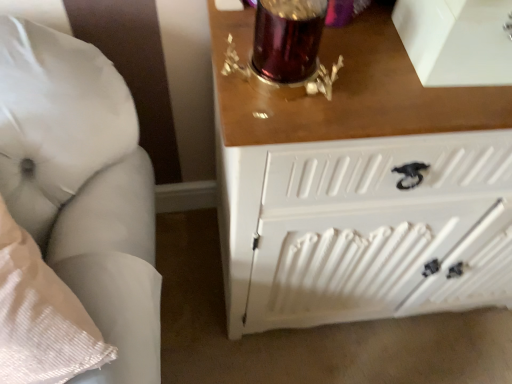
Question: Is white painted wood radiator at lower right taller or shorter than white fabric pillow at left?

Choices:
 (A) short
 (B) tall

Answer: (A)

Question: Does point (492, 216) appear closer or farther from the camera than point (153, 364)?

Choices:
 (A) farther
 (B) closer

Answer: (A)

Question: Is white painted wood radiator at lower right situated inside white fabric pillow at left or outside?

Choices:
 (A) inside
 (B) outside

Answer: (B)

Question: From a real-world perspective, relative to white painted wood radiator at lower right, is white fabric pillow at left vertically above or below?

Choices:
 (A) above
 (B) below

Answer: (A)

Question: Is point (46, 208) closer or farther from the camera than point (373, 279)?

Choices:
 (A) farther
 (B) closer

Answer: (B)

Question: From the image's perspective, is white fabric pillow at left positioned above or below white painted wood radiator at lower right?

Choices:
 (A) below
 (B) above

Answer: (B)

Question: In terms of height, does white fabric pillow at left look taller or shorter compared to white painted wood radiator at lower right?

Choices:
 (A) short
 (B) tall

Answer: (B)